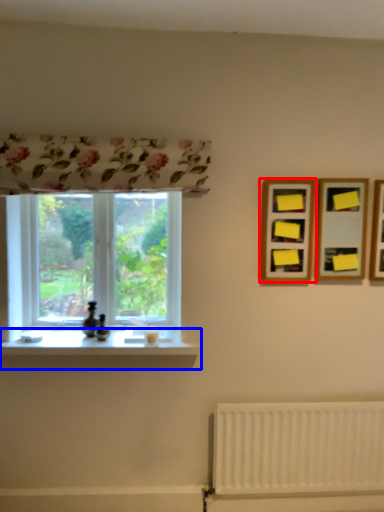
Question: Which point is further to the camera, picture frame (highlighted by a red box) or window sill (highlighted by a blue box)?

Choices:
 (A) picture frame
 (B) window sill

Answer: (A)